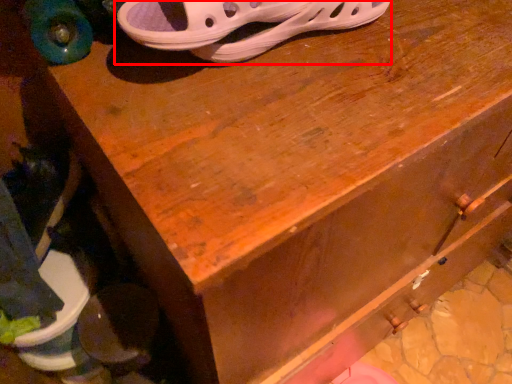
Question: Observing the image, what is the correct spatial positioning of footwear (annotated by the red box) in reference to footwear?

Choices:
 (A) left
 (B) right

Answer: (B)